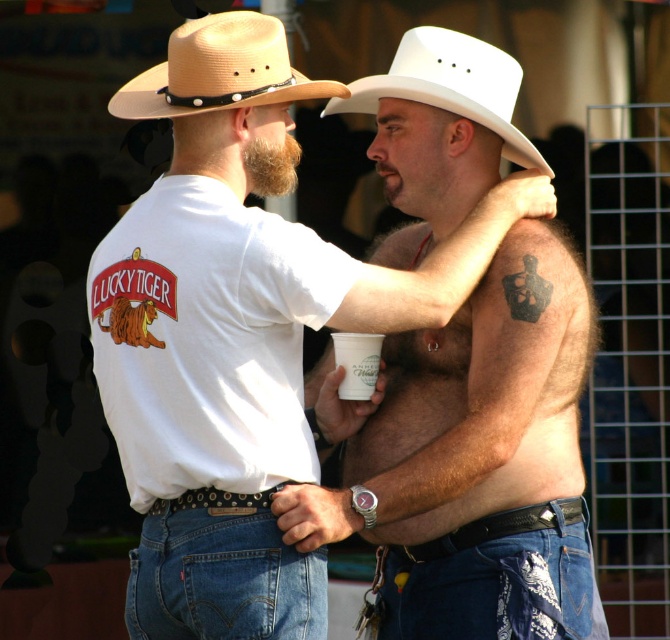
Question: Which of the following is the closest to the observer?

Choices:
 (A) smooth skin tattoo at upper right
 (B) denim jeans at lower right

Answer: (A)

Question: Considering the relative positions of white cotton shirt at center and white felt cowboy hat at upper center in the image provided, where is white cotton shirt at center located with respect to white felt cowboy hat at upper center?

Choices:
 (A) right
 (B) left

Answer: (B)

Question: Among these points, which one is farthest from the camera?

Choices:
 (A) (521, 512)
 (B) (529, 214)
 (C) (283, 40)
 (D) (433, 84)

Answer: (D)

Question: In this image, where is white cotton shirt at center located relative to white felt cowboy hat at upper center?

Choices:
 (A) right
 (B) left

Answer: (B)

Question: Which of these objects is positioned closest to the denim jeans at lower center?

Choices:
 (A) white cotton shirt at center
 (B) smooth skin tattoo at upper right
 (C) tan straw hat at upper left

Answer: (A)

Question: Is tan straw hat at upper left above white paper cup at upper center?

Choices:
 (A) yes
 (B) no

Answer: (A)